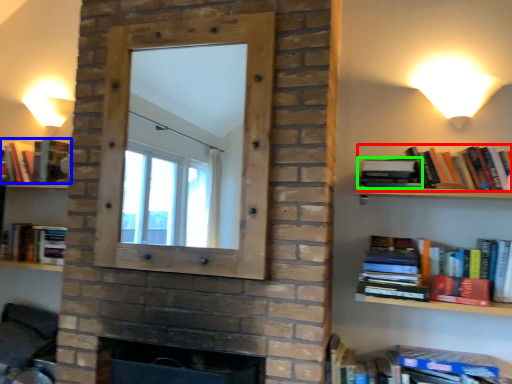
Question: Based on their relative distances, which object is farther from book (highlighted by a red box)? Choose from book (highlighted by a blue box) and book (highlighted by a green box).

Choices:
 (A) book
 (B) book

Answer: (A)